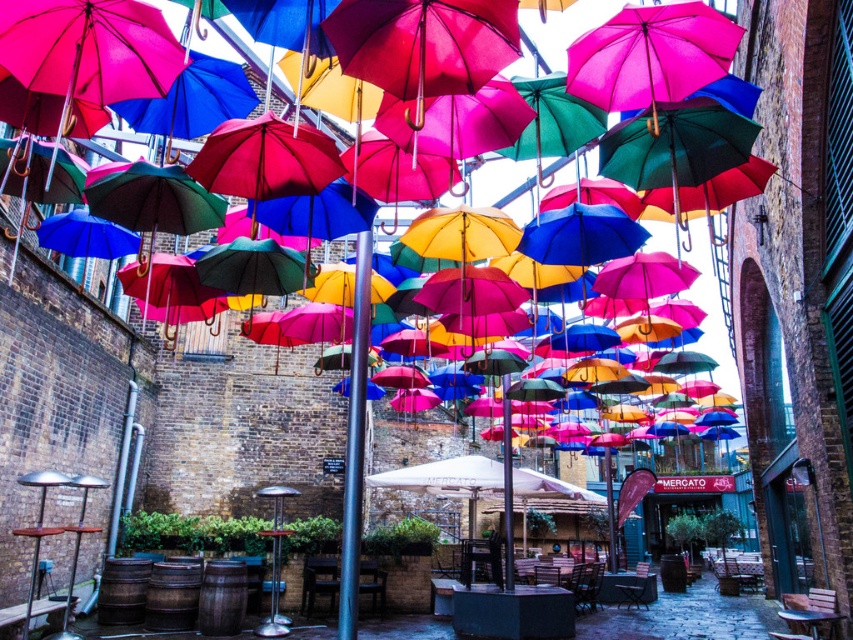
Question: Can you confirm if polished metal pole at center is bigger than white fabric umbrella at center?

Choices:
 (A) yes
 (B) no

Answer: (A)

Question: Can you confirm if polished metal pole at center is thinner than white fabric umbrella at center?

Choices:
 (A) no
 (B) yes

Answer: (A)

Question: Is polished metal pole at center positioned behind white fabric umbrella at center?

Choices:
 (A) no
 (B) yes

Answer: (A)

Question: Which point is closer to the camera?

Choices:
 (A) (469, 458)
 (B) (352, 388)

Answer: (B)

Question: Among these points, which one is farthest from the camera?

Choices:
 (A) (468, 458)
 (B) (346, 563)

Answer: (A)